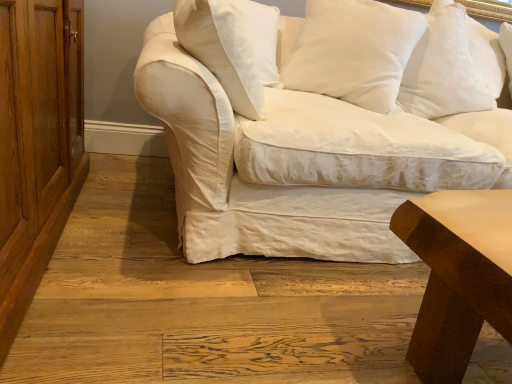
Question: From a real-world perspective, is smooth brown wood table at lower right physically below white cotton couch at center?

Choices:
 (A) yes
 (B) no

Answer: (A)

Question: Is smooth brown wood table at lower right positioned beyond the bounds of white cotton couch at center?

Choices:
 (A) yes
 (B) no

Answer: (A)

Question: Does smooth brown wood table at lower right appear on the right side of white cotton couch at center?

Choices:
 (A) yes
 (B) no

Answer: (B)

Question: Is smooth brown wood table at lower right oriented towards white cotton couch at center?

Choices:
 (A) yes
 (B) no

Answer: (B)

Question: Is the position of smooth brown wood table at lower right less distant than that of white cotton couch at center?

Choices:
 (A) yes
 (B) no

Answer: (A)

Question: Looking at the image, does white cotton pillow at upper right, the 4th pillow from the left, seem bigger or smaller compared to white cotton pillow at upper center, placed as the 3th pillow when sorted from right to left?

Choices:
 (A) big
 (B) small

Answer: (B)

Question: Considering the positions of white cotton pillow at upper right, the 4th pillow from the left, and white cotton pillow at upper center, placed as the second pillow when sorted from left to right, in the image, is white cotton pillow at upper right, the 4th pillow from the left, taller or shorter than white cotton pillow at upper center, placed as the second pillow when sorted from left to right,?

Choices:
 (A) tall
 (B) short

Answer: (A)

Question: Considering the positions of white cotton pillow at upper right, the 4th pillow from the left, and white cotton pillow at upper center, placed as the second pillow when sorted from left to right, in the image, is white cotton pillow at upper right, the 4th pillow from the left, wider or thinner than white cotton pillow at upper center, placed as the second pillow when sorted from left to right,?

Choices:
 (A) thin
 (B) wide

Answer: (A)

Question: From the image's perspective, is white cotton pillow at upper right, which appears as the first pillow when viewed from the right, above or below white cotton pillow at upper center, placed as the second pillow when sorted from left to right?

Choices:
 (A) above
 (B) below

Answer: (A)

Question: Looking at the image, does white cotton couch at center seem bigger or smaller compared to white cotton pillow at upper right, which is the second pillow from right to left?

Choices:
 (A) big
 (B) small

Answer: (A)

Question: Considering their positions, is white cotton couch at center located in front of or behind white cotton pillow at upper right, which appears as the third pillow when viewed from the left?

Choices:
 (A) behind
 (B) front

Answer: (B)

Question: Is white cotton couch at center spatially inside white cotton pillow at upper right, which appears as the third pillow when viewed from the left, or outside of it?

Choices:
 (A) outside
 (B) inside

Answer: (A)

Question: Is white cotton couch at center taller or shorter than white cotton pillow at upper right, which appears as the third pillow when viewed from the left?

Choices:
 (A) short
 (B) tall

Answer: (B)

Question: From the image's perspective, is white cotton pillow at upper right, which appears as the first pillow when viewed from the right, above or below smooth brown wood table at lower right?

Choices:
 (A) above
 (B) below

Answer: (A)

Question: Is white cotton pillow at upper right, which appears as the first pillow when viewed from the right, inside the boundaries of smooth brown wood table at lower right, or outside?

Choices:
 (A) inside
 (B) outside

Answer: (B)